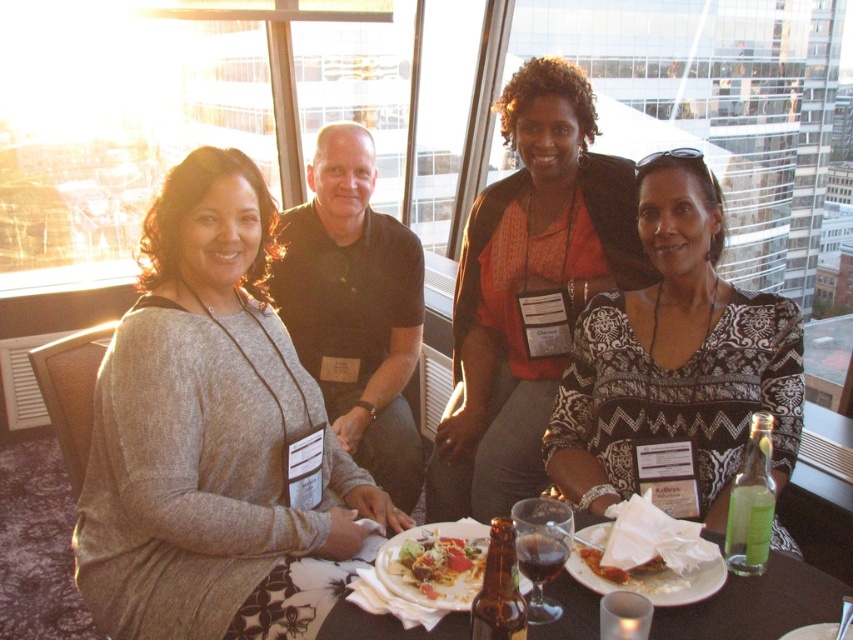
Question: Does matte gray sweater at left have a lesser width compared to translucent glass plate at center?

Choices:
 (A) yes
 (B) no

Answer: (A)

Question: Is black printed blouse at center further to the viewer compared to crunchy tortilla chips at center?

Choices:
 (A) no
 (B) yes

Answer: (B)

Question: Can you confirm if matte gray sweater at left is wider than black printed blouse at center?

Choices:
 (A) no
 (B) yes

Answer: (B)

Question: Which of the following is the farthest from the observer?

Choices:
 (A) (364, 627)
 (B) (418, 566)
 (C) (784, 428)
 (D) (613, 579)

Answer: (C)

Question: Among these objects, which one is nearest to the camera?

Choices:
 (A) black printed blouse at center
 (B) matte gray sweater at left
 (C) crunchy tortilla chips at center

Answer: (C)

Question: Which is farther from the matte gray sweater at left?

Choices:
 (A) white matte plate at lower right
 (B) matte orange blouse at center
 (C) translucent glass plate at center

Answer: (B)